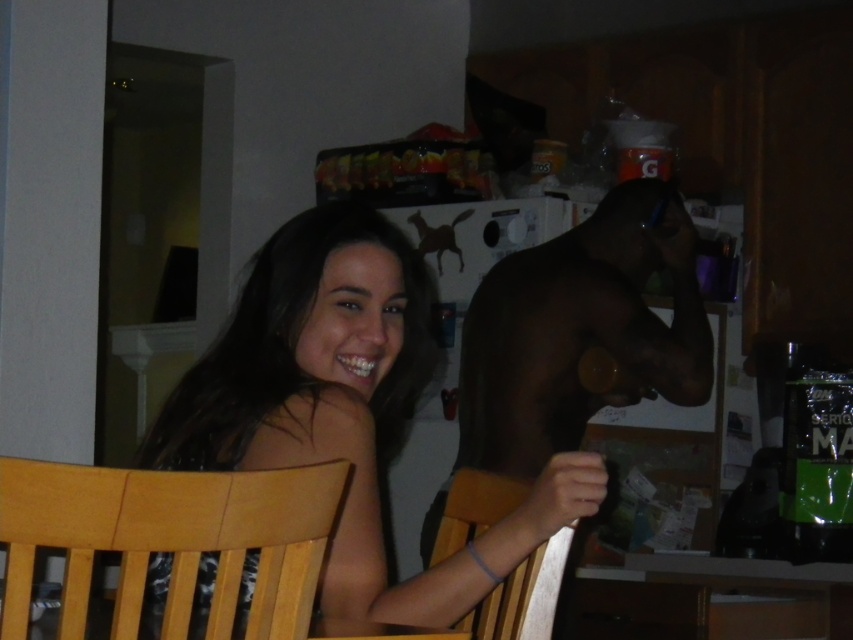
You are standing in the kitchen and want to reach the point marked at coordinates (299,353) on the refrigerator. If your outstretched hand can reach up to 1.5 meters, can you reach that point?

The point at coordinates (299,353) is 1.52 meters away from the viewer. Since your hand can only reach up to 1.5 meters, you cannot reach that point.

Based on the scene description, can you determine if the smooth skin girl at center is wider than the dark brown hair at center?

The smooth skin girl at center is wider than the dark brown hair at center according to the description.

Looking at the image, which object is bigger between the smooth skin girl at center and the dark brown hair at center?

The smooth skin girl at center is larger in size than the dark brown hair at center.